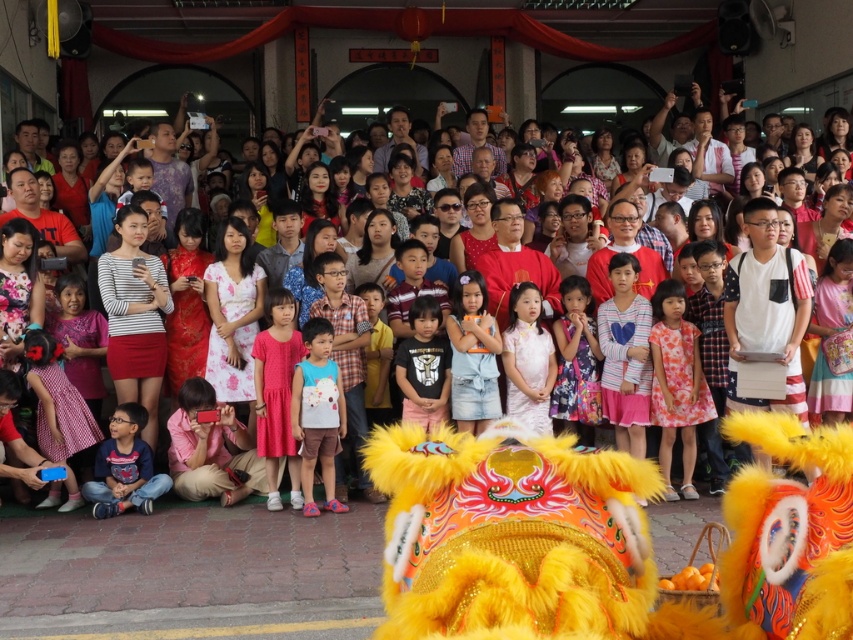
How much distance is there between pink cotton dress at center and matte pink dress at center?

They are 2.85 meters apart.

What do you see at coordinates (277, 394) in the screenshot? I see `pink cotton dress at center` at bounding box center [277, 394].

You are a GUI agent. You are given a task and a screenshot of the screen. Output one action in this format:
    pyautogui.click(x=<x>, y=<y>)
    Task: Click on the pink cotton dress at center
    The height and width of the screenshot is (640, 853).
    Given the screenshot: What is the action you would take?
    pyautogui.click(x=277, y=394)

Is floral dress at center smaller than pink cotton dress at center?

Incorrect, floral dress at center is not smaller in size than pink cotton dress at center.

This screenshot has width=853, height=640. I want to click on floral dress at center, so click(x=676, y=384).

Can you confirm if matte pink dress at center is taller than black cotton shirt at center?

Correct, matte pink dress at center is much taller as black cotton shirt at center.

Who is taller, matte pink dress at center or black cotton shirt at center?

Standing taller between the two is matte pink dress at center.

Who is more forward, (532, 381) or (431, 317)?

Point (532, 381)

Locate an element on the screen. This screenshot has width=853, height=640. matte pink dress at center is located at coordinates (527, 358).